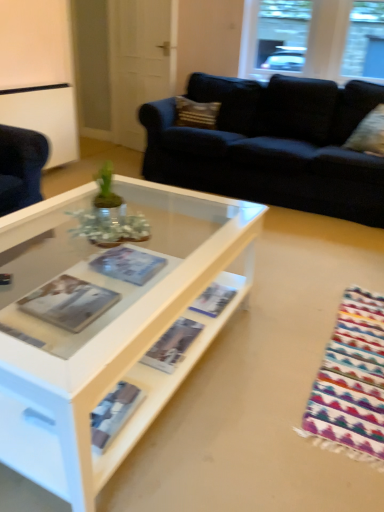
Question: Is matte paper magazine at center, arranged as the 1th magazine when viewed from the left, facing towards textured beige pillow at upper center, marked as the 2th pillow in a right-to-left arrangement?

Choices:
 (A) no
 (B) yes

Answer: (A)

Question: Is matte paper magazine at center, arranged as the 1th magazine when viewed from the left, next to textured beige pillow at upper center, marked as the 2th pillow in a right-to-left arrangement?

Choices:
 (A) no
 (B) yes

Answer: (A)

Question: Considering the relative sizes of matte paper magazine at center, the 3th magazine when ordered from right to left, and textured beige pillow at upper center, marked as the 2th pillow in a right-to-left arrangement, in the image provided, is matte paper magazine at center, the 3th magazine when ordered from right to left, wider than textured beige pillow at upper center, marked as the 2th pillow in a right-to-left arrangement,?

Choices:
 (A) yes
 (B) no

Answer: (A)

Question: Can you confirm if matte paper magazine at center, the 3th magazine when ordered from right to left, is thinner than textured beige pillow at upper center, the first pillow when ordered from back to front?

Choices:
 (A) yes
 (B) no

Answer: (B)

Question: Is the depth of matte paper magazine at center, the 3th magazine when ordered from right to left, greater than that of textured beige pillow at upper center, the first pillow when ordered from back to front?

Choices:
 (A) no
 (B) yes

Answer: (A)

Question: Is point (208, 115) positioned closer to the camera than point (271, 72)?

Choices:
 (A) farther
 (B) closer

Answer: (B)

Question: Do you think textured beige pillow at upper center, arranged as the second pillow when viewed from the front, is within clear glass window at upper center, or outside of it?

Choices:
 (A) outside
 (B) inside

Answer: (A)

Question: In terms of width, does textured beige pillow at upper center, arranged as the second pillow when viewed from the front, look wider or thinner when compared to clear glass window at upper center?

Choices:
 (A) wide
 (B) thin

Answer: (A)

Question: Considering the positions of textured beige pillow at upper center, positioned as the 1th pillow in top-to-bottom order, and clear glass window at upper center in the image, is textured beige pillow at upper center, positioned as the 1th pillow in top-to-bottom order, taller or shorter than clear glass window at upper center?

Choices:
 (A) tall
 (B) short

Answer: (B)

Question: Considering the positions of point (228, 287) and point (132, 75), is point (228, 287) closer or farther from the camera than point (132, 75)?

Choices:
 (A) farther
 (B) closer

Answer: (B)

Question: Is matte paper magazine at center, the first magazine positioned from the right, spatially inside white glossy door at upper center, or outside of it?

Choices:
 (A) outside
 (B) inside

Answer: (A)

Question: From the image's perspective, is matte paper magazine at center, the first magazine positioned from the right, above or below white glossy door at upper center?

Choices:
 (A) above
 (B) below

Answer: (B)

Question: Relative to white glossy door at upper center, is matte paper magazine at center, the first magazine positioned from the right, in front or behind?

Choices:
 (A) behind
 (B) front

Answer: (B)

Question: From a real-world perspective, relative to textured beige pillow at upper center, arranged as the second pillow when viewed from the front, is matte paper magazine at center, arranged as the 1th magazine when viewed from the left, vertically above or below?

Choices:
 (A) below
 (B) above

Answer: (A)

Question: Would you say matte paper magazine at center, arranged as the 1th magazine when viewed from the left, is to the left or to the right of textured beige pillow at upper center, marked as the 2th pillow in a right-to-left arrangement, in the picture?

Choices:
 (A) right
 (B) left

Answer: (B)